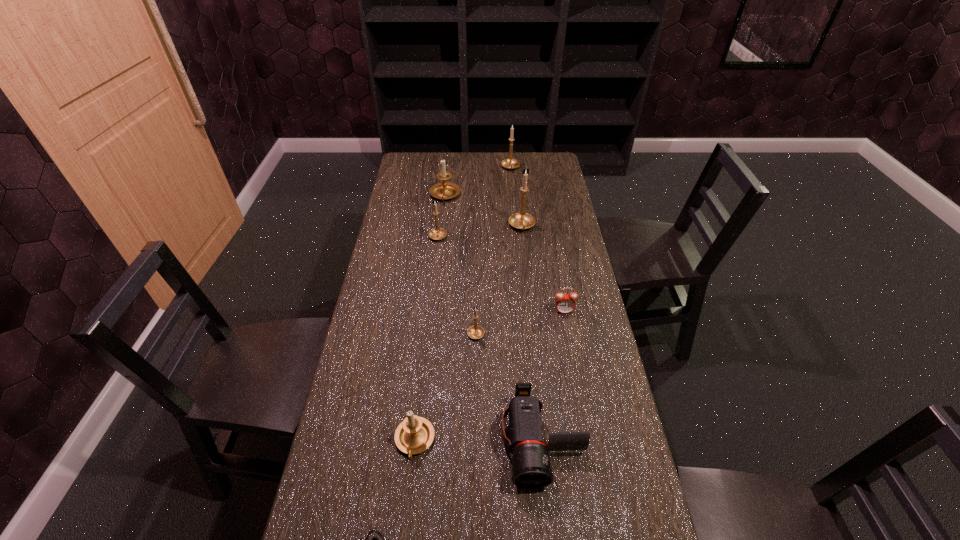
Identify the location of free location at the left edge of the desktop. This screenshot has height=540, width=960. (403, 183).

I want to click on vacant space at the right edge, so click(578, 454).

Locate an element on the screen. The image size is (960, 540). vacant space at the far right corner is located at coordinates (525, 159).

The width and height of the screenshot is (960, 540). In order to click on free space between the camcorder and the third gold candle holder from right to left in this screenshot , I will do `click(509, 386)`.

This screenshot has width=960, height=540. I want to click on vacant region between the third biggest gold candle holder and the biggest gold candle holder, so click(x=480, y=231).

You are a GUI agent. You are given a task and a screenshot of the screen. Output one action in this format:
    pyautogui.click(x=<x>, y=<y>)
    Task: Click on the free space between the second tallest candle holder and the alarm clock
    
    Given the screenshot: What is the action you would take?
    pyautogui.click(x=538, y=239)

Locate an element on the screen. The height and width of the screenshot is (540, 960). free space that is in between the eighth shortest object and the nearest candle holder is located at coordinates (463, 305).

Find the location of a particular element. vacant point located between the tallest candle holder and the second gold candle holder from left to right is located at coordinates (499, 280).

I want to click on vacant area between the camcorder and the biggest gold candle holder, so click(x=532, y=333).

Image resolution: width=960 pixels, height=540 pixels. What are the coordinates of `empty space between the camcorder and the second smallest gold candle holder` in the screenshot? It's located at (490, 338).